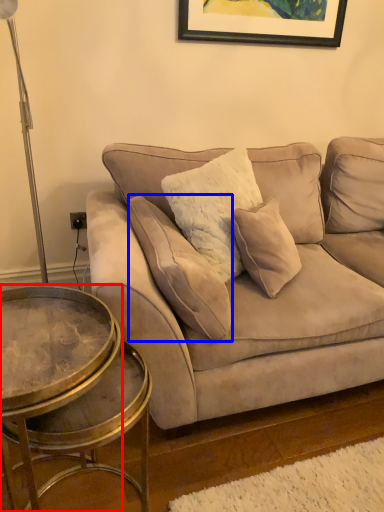
Question: Which of the following is the closest to the observer, coffee table (highlighted by a red box) or pillow (highlighted by a blue box)?

Choices:
 (A) coffee table
 (B) pillow

Answer: (A)